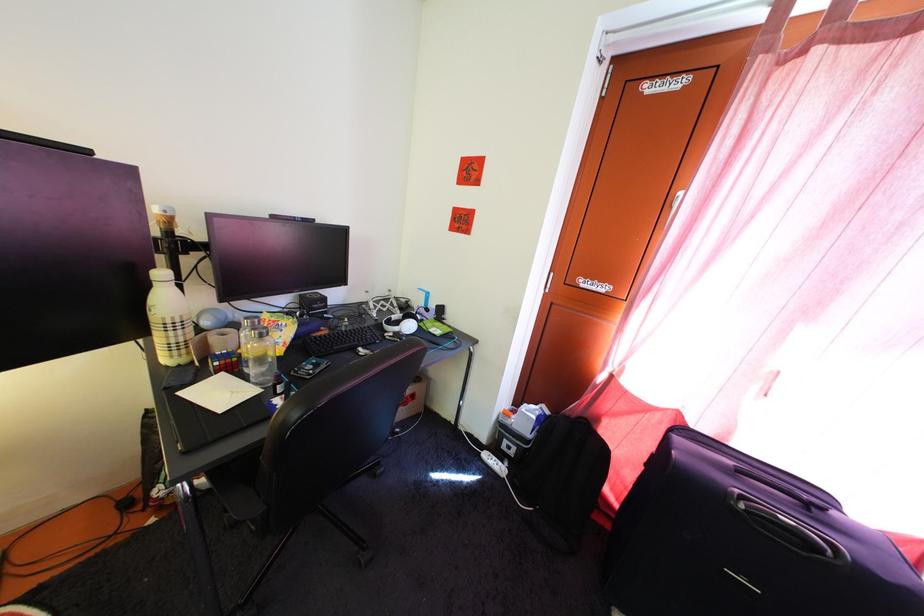
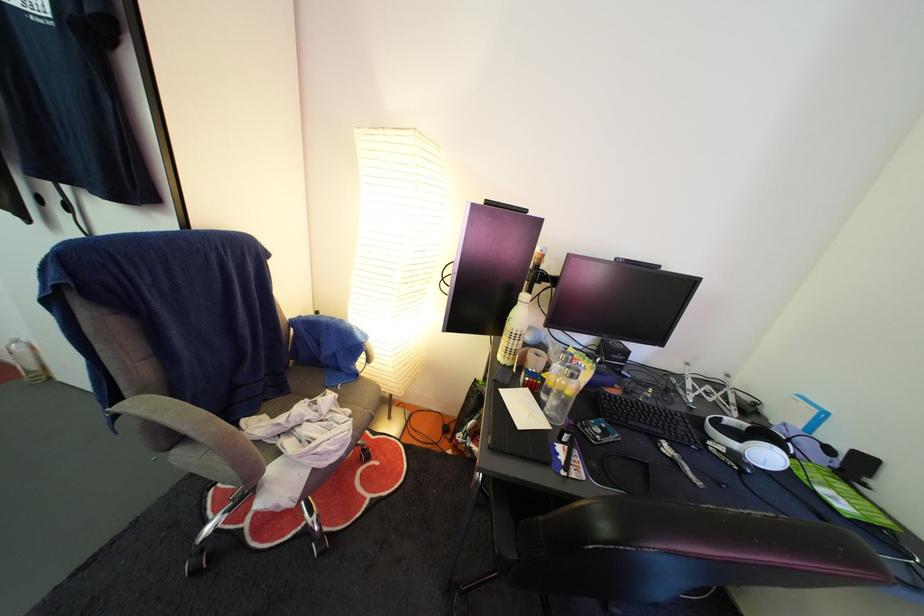
In the second image, find the point that corresponds to (175,397) in the first image.

(504, 389)